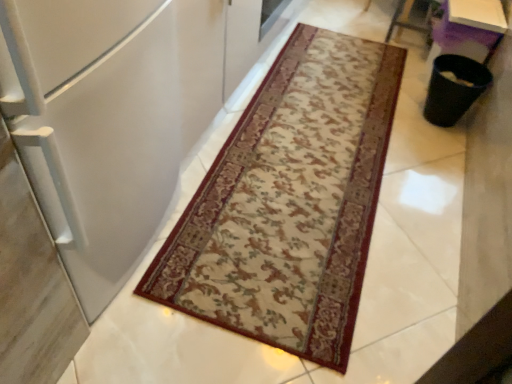
Question: Relative to beige carpet with floral pattern at center, is purple plastic table at upper right in front or behind?

Choices:
 (A) front
 (B) behind

Answer: (B)

Question: Would you say purple plastic table at upper right is inside or outside beige carpet with floral pattern at center?

Choices:
 (A) outside
 (B) inside

Answer: (A)

Question: Estimate the real-world distances between objects in this image. Which object is closer to the purple plastic table at upper right?

Choices:
 (A) beige carpet with floral pattern at center
 (B) white matte refrigerator at left

Answer: (A)

Question: Considering the real-world distances, which object is closest to the beige carpet with floral pattern at center?

Choices:
 (A) purple plastic table at upper right
 (B) white matte refrigerator at left

Answer: (B)